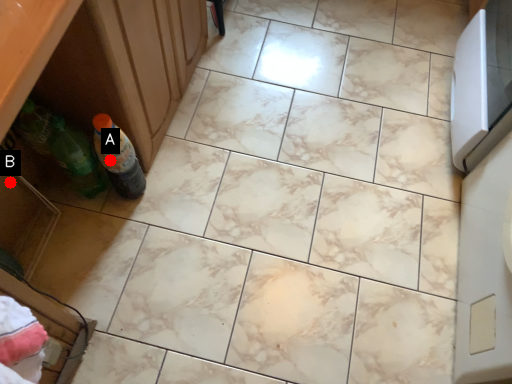
Question: Two points are circled on the image, labeled by A and B beside each circle. Which point is farther to the camera?

Choices:
 (A) A is further
 (B) B is further

Answer: (B)